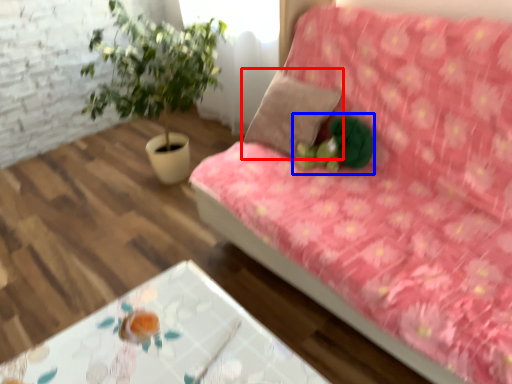
Question: Which object is closer to the camera taking this photo, pillow (highlighted by a red box) or toy (highlighted by a blue box)?

Choices:
 (A) pillow
 (B) toy

Answer: (B)